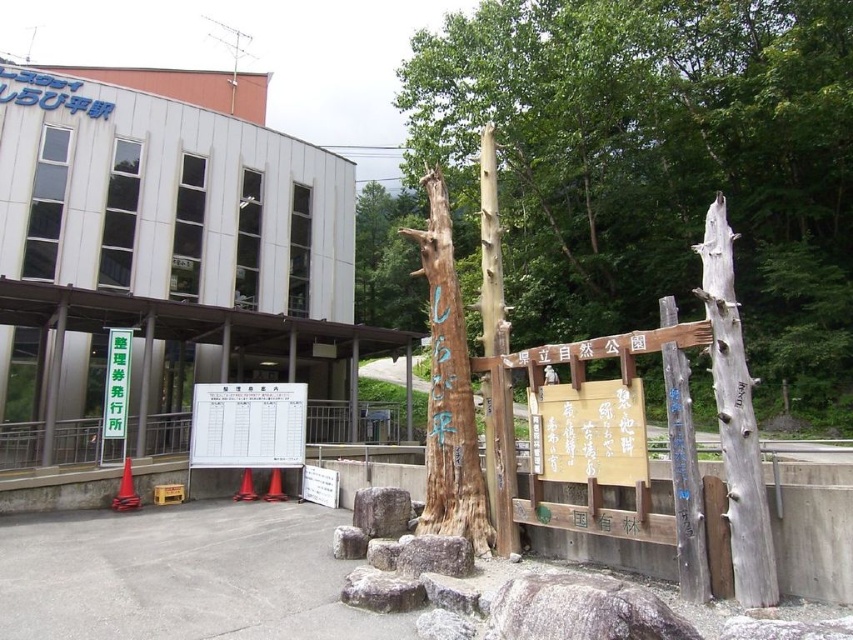
You are standing at the entrance of the building and want to place a 5 meter long banner between the natural wood signpost at center and the white board with printed text. Will the banner fit?

The distance between the natural wood signpost at center and the white board with printed text is 5.31 meters, so the 5 meter long banner will fit with some space to spare.